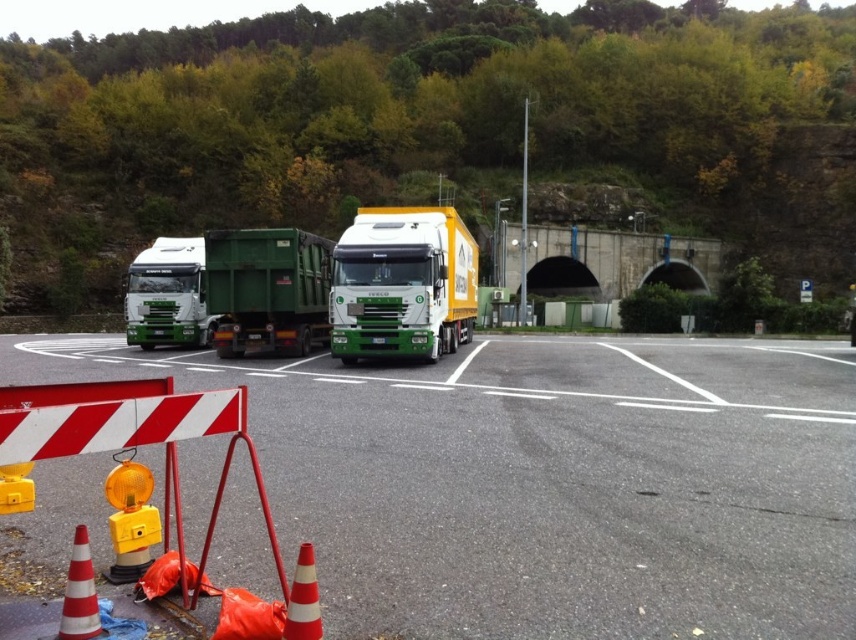
You are a delivery driver who needs to pass through the construction site shown in the image. There is a point marked at coordinates (402, 284). What object is located at that point?

The point at coordinates (402, 284) indicates the green matte truck at center.

You are a delivery driver who needs to pass through this construction site. Your truck is 10 meters long. There is a green matte truck at center and an orange reflective cone at lower left. Can your truck safely pass through the space between them without hitting either?

The distance between the green matte truck at center and the orange reflective cone at lower left is 11.05 meters. Since your truck is 10 meters long, there is enough space to safely pass through without hitting either object.